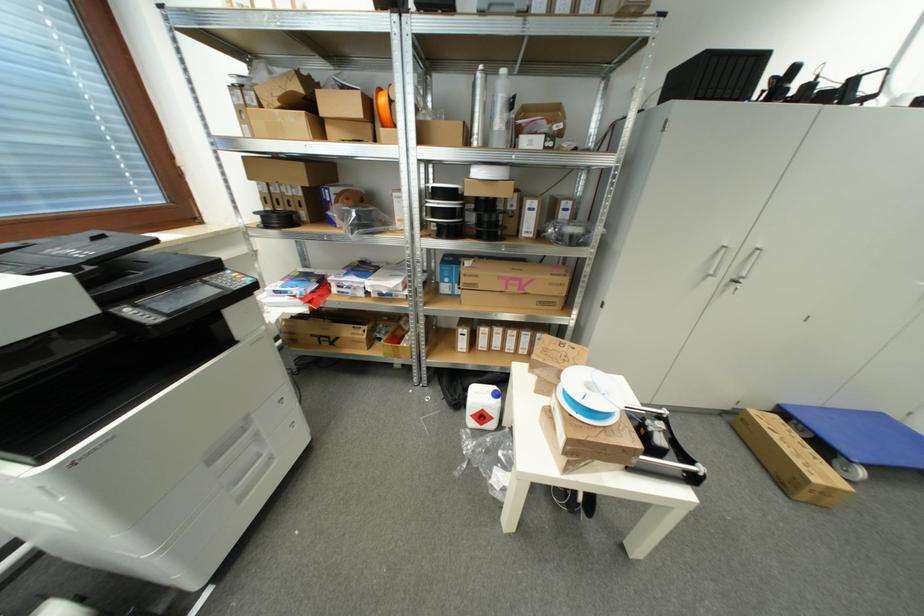
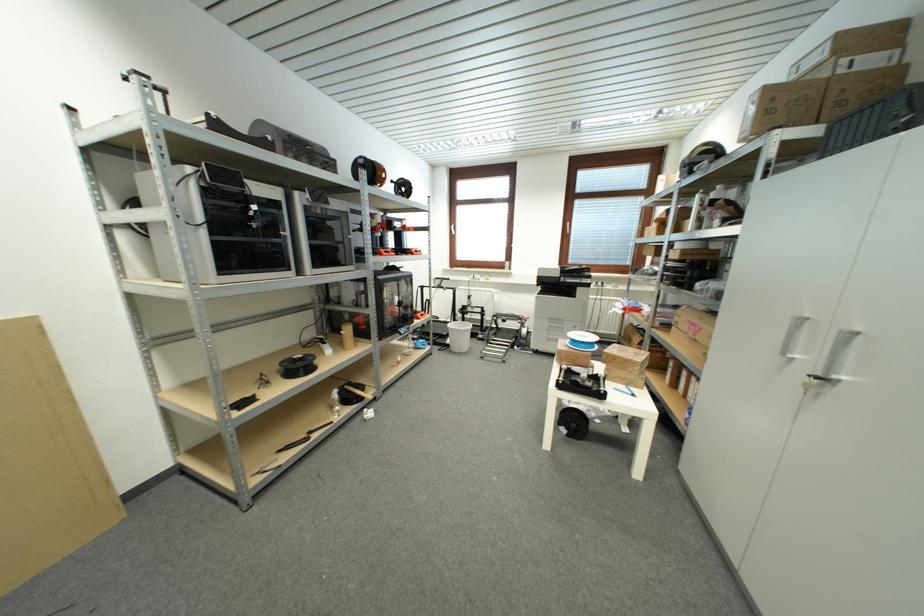
Where in the second image is the point corresponding to (x=594, y=387) from the first image?

(590, 339)